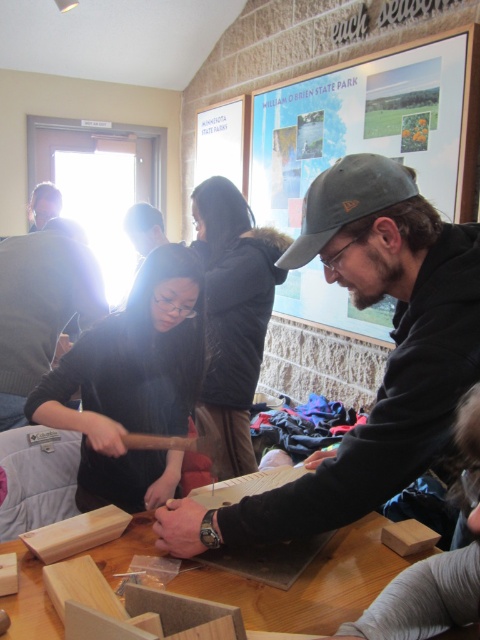
Who is lower down, matte black sweater at center or natural wood table at center?

Positioned lower is natural wood table at center.

Looking at this image, who is more forward, (199, 296) or (132, 524)?

Point (132, 524) is more forward.

Identify the location of matte black sweater at center. This screenshot has height=640, width=480. (132, 385).

Who is more forward, (336, 180) or (268, 428)?

Positioned in front is point (336, 180).

Which is below, matte black cap at center or dark blue fabric at center?

dark blue fabric at center is below.

What do you see at coordinates (386, 362) in the screenshot? This screenshot has width=480, height=640. I see `matte black cap at center` at bounding box center [386, 362].

You are a GUI agent. You are given a task and a screenshot of the screen. Output one action in this format:
    pyautogui.click(x=<x>, y=<y>)
    Task: Click on the matte black cap at center
    This screenshot has height=640, width=480.
    Given the screenshot: What is the action you would take?
    pyautogui.click(x=386, y=362)

Who is lower down, black fuzzy coat at center or dark blue fabric at center?

dark blue fabric at center is below.

Is point (251, 296) positioned behind point (289, 428)?

No, (251, 296) is in front of (289, 428).

Identify the location of black fuzzy coat at center. (233, 310).